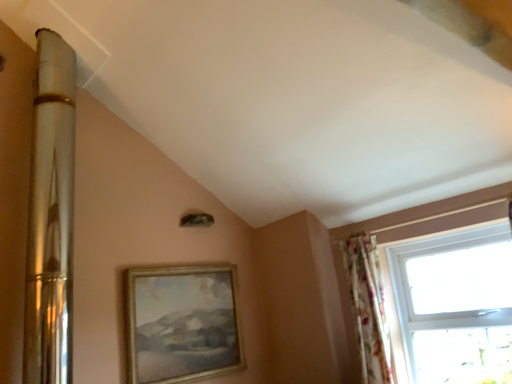
Question: From the image's perspective, is transparent glass window at right under floral fabric curtain at right?

Choices:
 (A) no
 (B) yes

Answer: (A)

Question: Is transparent glass window at right further to camera compared to floral fabric curtain at right?

Choices:
 (A) no
 (B) yes

Answer: (A)

Question: Is transparent glass window at right positioned before floral fabric curtain at right?

Choices:
 (A) no
 (B) yes

Answer: (B)

Question: Is transparent glass window at right next to floral fabric curtain at right and touching it?

Choices:
 (A) no
 (B) yes

Answer: (A)

Question: Is transparent glass window at right facing towards floral fabric curtain at right?

Choices:
 (A) yes
 (B) no

Answer: (A)

Question: Considering the positions of gold/golden wood picture frame at center and floral fabric curtain at right in the image, is gold/golden wood picture frame at center taller or shorter than floral fabric curtain at right?

Choices:
 (A) short
 (B) tall

Answer: (A)

Question: In the image, is gold/golden wood picture frame at center positioned in front of or behind floral fabric curtain at right?

Choices:
 (A) front
 (B) behind

Answer: (A)

Question: Considering the positions of gold/golden wood picture frame at center and floral fabric curtain at right in the image, is gold/golden wood picture frame at center wider or thinner than floral fabric curtain at right?

Choices:
 (A) wide
 (B) thin

Answer: (B)

Question: Is gold/golden wood picture frame at center bigger or smaller than floral fabric curtain at right?

Choices:
 (A) big
 (B) small

Answer: (A)

Question: Considering the positions of point (371, 317) and point (352, 372), is point (371, 317) closer or farther from the camera than point (352, 372)?

Choices:
 (A) closer
 (B) farther

Answer: (A)

Question: From their relative heights in the image, would you say floral fabric curtain at right is taller or shorter than transparent glass window at right?

Choices:
 (A) short
 (B) tall

Answer: (B)

Question: From a real-world perspective, relative to transparent glass window at right, is floral fabric curtain at right vertically above or below?

Choices:
 (A) above
 (B) below

Answer: (A)

Question: Is floral fabric curtain at right spatially inside transparent glass window at right, or outside of it?

Choices:
 (A) outside
 (B) inside

Answer: (A)

Question: Is transparent glass window at right taller or shorter than floral fabric curtain at right?

Choices:
 (A) tall
 (B) short

Answer: (B)

Question: Based on their positions, is transparent glass window at right located to the left or right of floral fabric curtain at right?

Choices:
 (A) left
 (B) right

Answer: (B)